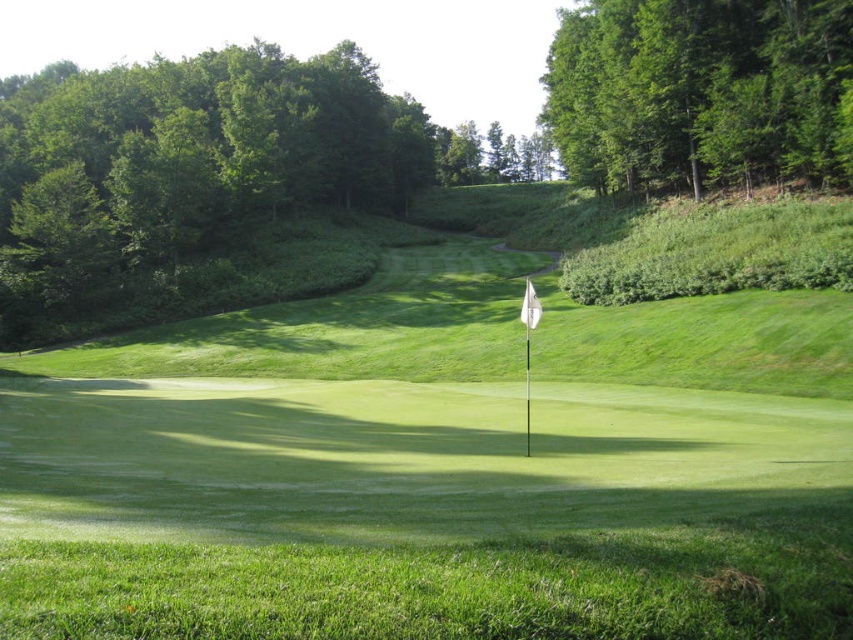
Does green grass flag at center appear on the right side of green leafy tree at upper right?

Incorrect, green grass flag at center is not on the right side of green leafy tree at upper right.

Is green grass flag at center above green leafy tree at upper right?

No.

Where is `green grass flag at center`? The image size is (853, 640). green grass flag at center is located at coordinates (437, 467).